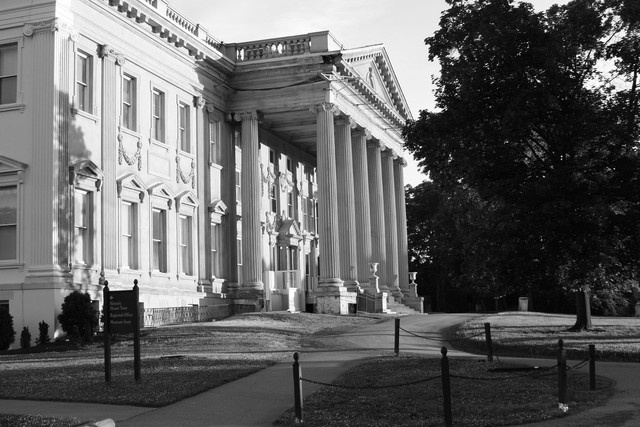
At what (x,y) coordinates should I click in order to perform the action: click on door. Please return your answer as a coordinate pair (x, y). The image size is (640, 427). Looking at the image, I should click on (296, 251).